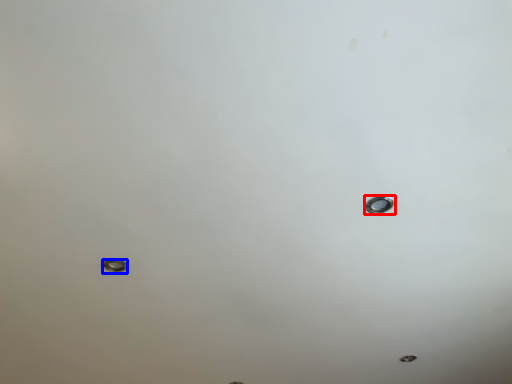
Question: Among these objects, which one is farthest to the camera, nail (highlighted by a red box) or bolt (highlighted by a blue box)?

Choices:
 (A) nail
 (B) bolt

Answer: (B)